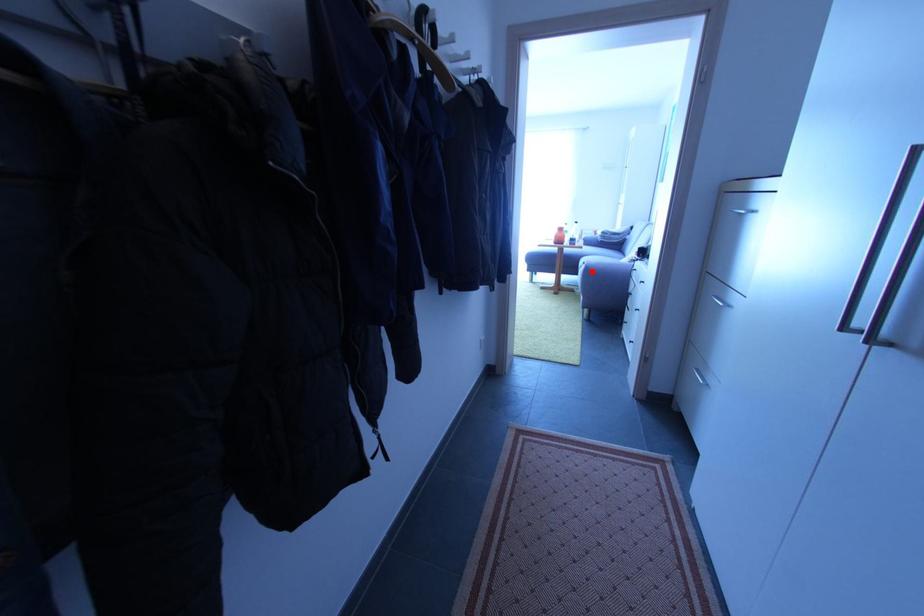
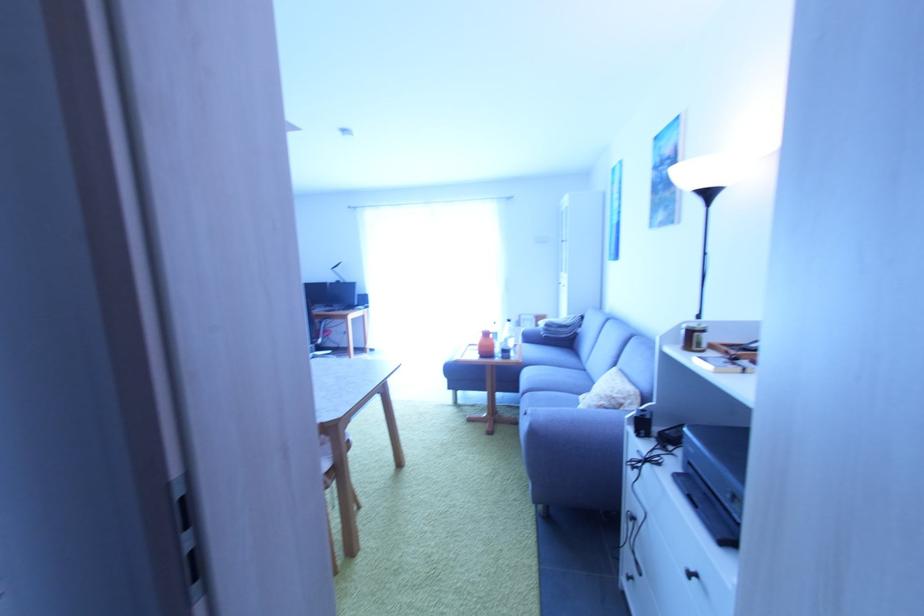
Question: I am providing you with two images of the same scene from different viewpoints. Image1 has a red point marked. In image2, the corresponding 3D location appears at what relative position? Reply with the corresponding letter.

Choices:
 (A) Closer
 (B) Farther

Answer: (B)